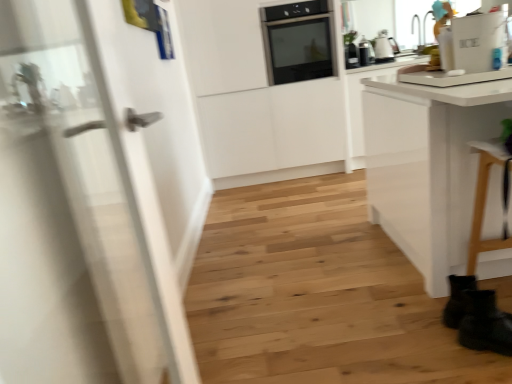
Locate an element on the screen. This screenshot has height=384, width=512. white glossy refrigerator at upper right is located at coordinates (472, 42).

Measure the distance between black glossy toaster at upper right, positioned as the second kitchen appliance in right-to-left order, and camera.

black glossy toaster at upper right, positioned as the second kitchen appliance in right-to-left order, and camera are 3.60 meters apart from each other.

Where is `black matte boot at lower right`? This screenshot has height=384, width=512. black matte boot at lower right is located at coordinates (485, 323).

Is point (453, 61) closer or farther from the camera than point (295, 23)?

Point (453, 61).

Is white glossy refrigerator at upper right not close to black glass oven at upper center?

white glossy refrigerator at upper right is far away from black glass oven at upper center.

From a real-world perspective, who is located lower, white glossy refrigerator at upper right or black glass oven at upper center?

From a 3D spatial view, white glossy refrigerator at upper right is below.

This screenshot has height=384, width=512. What are the coordinates of `appliance to the right of black glass oven at upper center` in the screenshot? It's located at (472, 42).

Which object is thinner, black glossy toaster at upper right, marked as the 1th kitchen appliance in a left-to-right arrangement, or white glossy refrigerator at upper right?

Thinner between the two is white glossy refrigerator at upper right.

Looking at this image, which is more to the left, black glossy toaster at upper right, marked as the 1th kitchen appliance in a left-to-right arrangement, or white glossy refrigerator at upper right?

black glossy toaster at upper right, marked as the 1th kitchen appliance in a left-to-right arrangement.

Is black glossy toaster at upper right, marked as the 1th kitchen appliance in a left-to-right arrangement, behind white glossy refrigerator at upper right?

Yes, black glossy toaster at upper right, marked as the 1th kitchen appliance in a left-to-right arrangement, is further from the viewer.

Which point is more distant from viewer, (353,45) or (476,63)?

The point (353,45) is behind.

Is matte silver kettle at upper right, the second kitchen appliance when ordered from left to right, taller or shorter than black glossy toaster at upper right, marked as the 1th kitchen appliance in a left-to-right arrangement?

Considering their sizes, matte silver kettle at upper right, the second kitchen appliance when ordered from left to right, has more height than black glossy toaster at upper right, marked as the 1th kitchen appliance in a left-to-right arrangement.

Considering the positions of objects matte silver kettle at upper right, the second kitchen appliance when ordered from left to right, and black glossy toaster at upper right, marked as the 1th kitchen appliance in a left-to-right arrangement, in the image provided, who is behind, matte silver kettle at upper right, the second kitchen appliance when ordered from left to right, or black glossy toaster at upper right, marked as the 1th kitchen appliance in a left-to-right arrangement,?

matte silver kettle at upper right, the second kitchen appliance when ordered from left to right, is further away from the camera.

Does matte silver kettle at upper right, the second kitchen appliance when ordered from left to right, have a smaller size compared to black glossy toaster at upper right, positioned as the second kitchen appliance in right-to-left order?

Incorrect, matte silver kettle at upper right, the second kitchen appliance when ordered from left to right, is not smaller in size than black glossy toaster at upper right, positioned as the second kitchen appliance in right-to-left order.

Looking at this image, is matte silver kettle at upper right, the second kitchen appliance when ordered from left to right, with black glossy toaster at upper right, marked as the 1th kitchen appliance in a left-to-right arrangement?

No, matte silver kettle at upper right, the second kitchen appliance when ordered from left to right, is not with black glossy toaster at upper right, marked as the 1th kitchen appliance in a left-to-right arrangement.

Is black glass oven at upper center inside or outside of white glossy refrigerator at upper right?

black glass oven at upper center is located beyond the bounds of white glossy refrigerator at upper right.

Are black glass oven at upper center and white glossy refrigerator at upper right far apart?

That's right, there is a large distance between black glass oven at upper center and white glossy refrigerator at upper right.

Does black glass oven at upper center have a greater height compared to white glossy refrigerator at upper right?

Yes.

Is black glass oven at upper center bigger than white glossy refrigerator at upper right?

Indeed, black glass oven at upper center has a larger size compared to white glossy refrigerator at upper right.

Considering the relative positions of black matte boot at lower right and matte silver kettle at upper right, the second kitchen appliance when ordered from left to right, in the image provided, is black matte boot at lower right to the left or to the right of matte silver kettle at upper right, the second kitchen appliance when ordered from left to right,?

Based on their positions, black matte boot at lower right is located to the left of matte silver kettle at upper right, the second kitchen appliance when ordered from left to right.

How many degrees apart are the facing directions of black matte boot at lower right and matte silver kettle at upper right, the second kitchen appliance when ordered from left to right?

They differ by 67.7 degrees in their facing directions.

From the picture: Could you tell me if black matte boot at lower right is facing matte silver kettle at upper right, which appears as the 1th kitchen appliance when viewed from the right?

No.

Is white glossy door at left at the left side of white glossy refrigerator at upper right?

Yes.

Does white glossy door at left have a lesser height compared to white glossy refrigerator at upper right?

No.

How many degrees apart are the facing directions of white glossy door at left and white glossy refrigerator at upper right?

The angle between the facing direction of white glossy door at left and the facing direction of white glossy refrigerator at upper right is 1.73 degrees.

How far apart are matte silver kettle at upper right, which appears as the 1th kitchen appliance when viewed from the right, and black matte boot at lower right?

The distance of matte silver kettle at upper right, which appears as the 1th kitchen appliance when viewed from the right, from black matte boot at lower right is 2.73 meters.

How many degrees apart are the facing directions of matte silver kettle at upper right, the second kitchen appliance when ordered from left to right, and black matte boot at lower right?

matte silver kettle at upper right, the second kitchen appliance when ordered from left to right, and black matte boot at lower right are facing 67.7 degrees away from each other.

Which object is positioned more to the right, matte silver kettle at upper right, which appears as the 1th kitchen appliance when viewed from the right, or black matte boot at lower right?

matte silver kettle at upper right, which appears as the 1th kitchen appliance when viewed from the right, is more to the right.

Is matte silver kettle at upper right, which appears as the 1th kitchen appliance when viewed from the right, bigger or smaller than black matte boot at lower right?

Considering their sizes, matte silver kettle at upper right, which appears as the 1th kitchen appliance when viewed from the right, takes up more space than black matte boot at lower right.

At what (x,y) coordinates should I click in order to perform the action: click on home appliance that is above the white glossy refrigerator at upper right (from a real-world perspective). Please return your answer as a coordinate pair (x, y). Looking at the image, I should click on (298, 41).

Image resolution: width=512 pixels, height=384 pixels. I want to click on kitchen appliance that is the 1st object located above the white glossy refrigerator at upper right (from the image's perspective), so click(351, 56).

Which object lies further to the anchor point black matte boot at lower right, white glossy refrigerator at upper right or black glass oven at upper center?

The object further to black matte boot at lower right is black glass oven at upper center.

Considering their positions, is black matte boot at lower right positioned closer to white glossy refrigerator at upper right than white glossy door at left?

Based on the image, black matte boot at lower right appears to be nearer to white glossy refrigerator at upper right.

Which object lies further to the anchor point matte silver kettle at upper right, the second kitchen appliance when ordered from left to right, black matte boot at lower right or black glossy toaster at upper right, marked as the 1th kitchen appliance in a left-to-right arrangement?

The object further to matte silver kettle at upper right, the second kitchen appliance when ordered from left to right, is black matte boot at lower right.

Looking at the image, which one is located further to white glossy door at left, black glass oven at upper center or black matte boot at lower right?

Among the two, black glass oven at upper center is located further to white glossy door at left.

From the image, which object appears to be nearer to black matte boot at lower right, matte silver kettle at upper right, the second kitchen appliance when ordered from left to right, or black glossy toaster at upper right, positioned as the second kitchen appliance in right-to-left order?

The object closer to black matte boot at lower right is black glossy toaster at upper right, positioned as the second kitchen appliance in right-to-left order.

Estimate the real-world distances between objects in this image. Which object is further from black glossy toaster at upper right, positioned as the second kitchen appliance in right-to-left order, white glossy refrigerator at upper right or black matte boot at lower right?

black matte boot at lower right is further to black glossy toaster at upper right, positioned as the second kitchen appliance in right-to-left order.

Looking at the image, which one is located further to matte silver kettle at upper right, the second kitchen appliance when ordered from left to right, black glass oven at upper center or black matte boot at lower right?

Among the two, black matte boot at lower right is located further to matte silver kettle at upper right, the second kitchen appliance when ordered from left to right.

Which object lies further to the anchor point black glossy toaster at upper right, marked as the 1th kitchen appliance in a left-to-right arrangement, matte silver kettle at upper right, the second kitchen appliance when ordered from left to right, or white glossy door at left?

white glossy door at left is positioned further to the anchor black glossy toaster at upper right, marked as the 1th kitchen appliance in a left-to-right arrangement.

Identify the location of kitchen appliance located between black matte boot at lower right and matte silver kettle at upper right, the second kitchen appliance when ordered from left to right, in the depth direction. This screenshot has width=512, height=384. (351, 56).

Locate an element on the screen. The image size is (512, 384). boot between white glossy door at left and black glossy toaster at upper right, positioned as the second kitchen appliance in right-to-left order, along the z-axis is located at coordinates pos(485,323).

Where is `appliance between black matte boot at lower right and black glass oven at upper center along the z-axis`? appliance between black matte boot at lower right and black glass oven at upper center along the z-axis is located at coordinates (472, 42).

Locate an element on the screen. Image resolution: width=512 pixels, height=384 pixels. home appliance positioned between white glossy door at left and matte silver kettle at upper right, which appears as the 1th kitchen appliance when viewed from the right, from near to far is located at coordinates (298, 41).